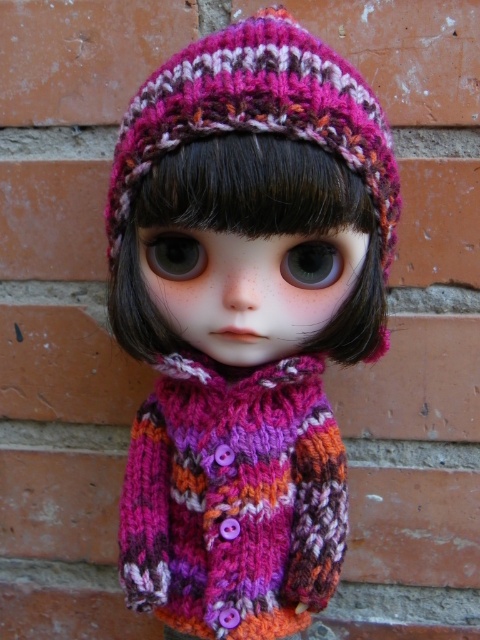
Can you confirm if knitted woolen sweater at center is positioned above knitted pink hat at upper center?

No.

What do you see at coordinates (244, 323) in the screenshot? The image size is (480, 640). I see `knitted woolen sweater at center` at bounding box center [244, 323].

Is point (229, 240) positioned in front of point (331, 118)?

No, (229, 240) is further to viewer.

Find the location of a particular element. The width and height of the screenshot is (480, 640). knitted woolen sweater at center is located at coordinates (244, 323).

Image resolution: width=480 pixels, height=640 pixels. I want to click on knitted woolen sweater at center, so click(x=244, y=323).

Is point (202, 172) farther from camera compared to point (210, 531)?

No, (202, 172) is in front of (210, 531).

Identify the location of knitted woolen sweater at center. (244, 323).

Which of these two, knitted wool scarf at center or knitted pink hat at upper center, stands shorter?

Standing shorter between the two is knitted pink hat at upper center.

What do you see at coordinates (233, 499) in the screenshot? This screenshot has width=480, height=640. I see `knitted wool scarf at center` at bounding box center [233, 499].

This screenshot has height=640, width=480. I want to click on knitted wool scarf at center, so click(x=233, y=499).